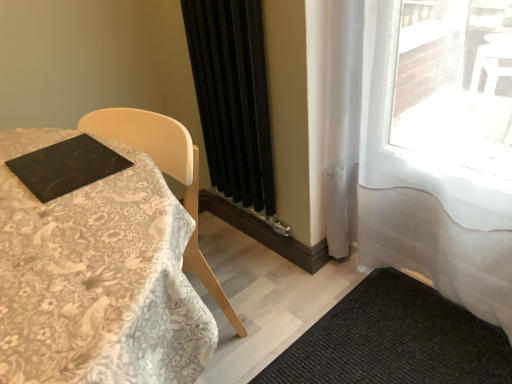
Question: From the image's perspective, is black matte curtain at center, the 2th curtain in the right-to-left sequence, positioned above or below white lace tablecloth at left?

Choices:
 (A) above
 (B) below

Answer: (A)

Question: Is black matte curtain at center, placed as the 1th curtain when sorted from left to right, taller or shorter than white lace tablecloth at left?

Choices:
 (A) tall
 (B) short

Answer: (A)

Question: Which object is the closest to the white lace tablecloth at left?

Choices:
 (A) black textured mat at lower right
 (B) black matte curtain at center, the 2th curtain in the right-to-left sequence
 (C) white sheer curtain at right, which is counted as the 2th curtain, starting from the left

Answer: (B)

Question: Which object is the closest to the white lace tablecloth at left?

Choices:
 (A) black matte curtain at center, the 2th curtain in the right-to-left sequence
 (B) black textured mat at lower right
 (C) white sheer curtain at right, which is counted as the 2th curtain, starting from the left

Answer: (A)